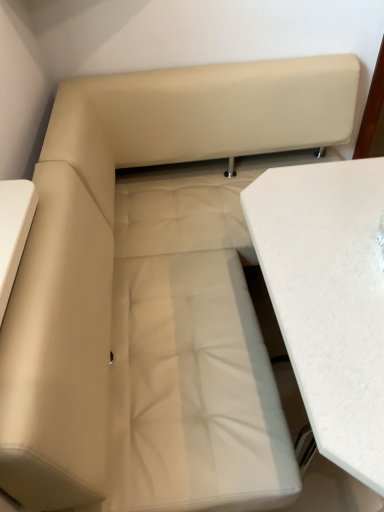
Locate an element on the screen. The image size is (384, 512). white glossy table at right is located at coordinates (328, 298).

The height and width of the screenshot is (512, 384). Describe the element at coordinates (328, 298) in the screenshot. I see `white glossy table at right` at that location.

Locate an element on the screen. white glossy table at right is located at coordinates (328, 298).